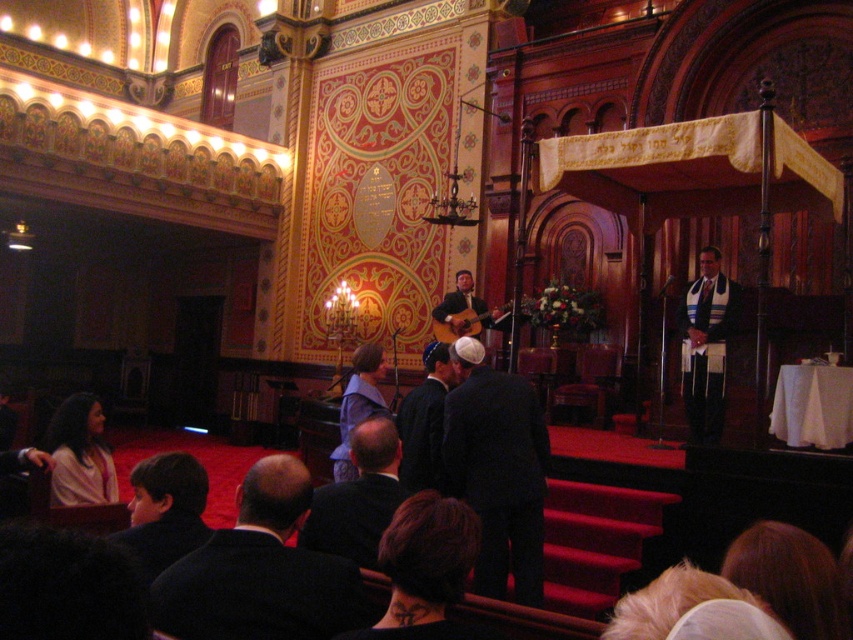
Question: Which point is farther from the camera taking this photo?

Choices:
 (A) (709, 260)
 (B) (366, 499)
 (C) (459, 326)
 (D) (498, 493)

Answer: (C)

Question: Which object is the farthest from the matte brown guitar at center?

Choices:
 (A) dark suit at center
 (B) dark brown suit at lower left
 (C) white textured kippah at center

Answer: (B)

Question: Does dark brown suit at lower left appear on the right side of dark blue suit at center?

Choices:
 (A) no
 (B) yes

Answer: (A)

Question: Can you confirm if black suit at lower left is positioned above dark blue suit at center?

Choices:
 (A) no
 (B) yes

Answer: (A)

Question: Which of the following is the farthest from the observer?

Choices:
 (A) matte brown guitar at center
 (B) dark suit at center
 (C) black matte suit at center

Answer: (A)

Question: Does black matte suit at center appear over matte pink sweater at lower left?

Choices:
 (A) yes
 (B) no

Answer: (A)